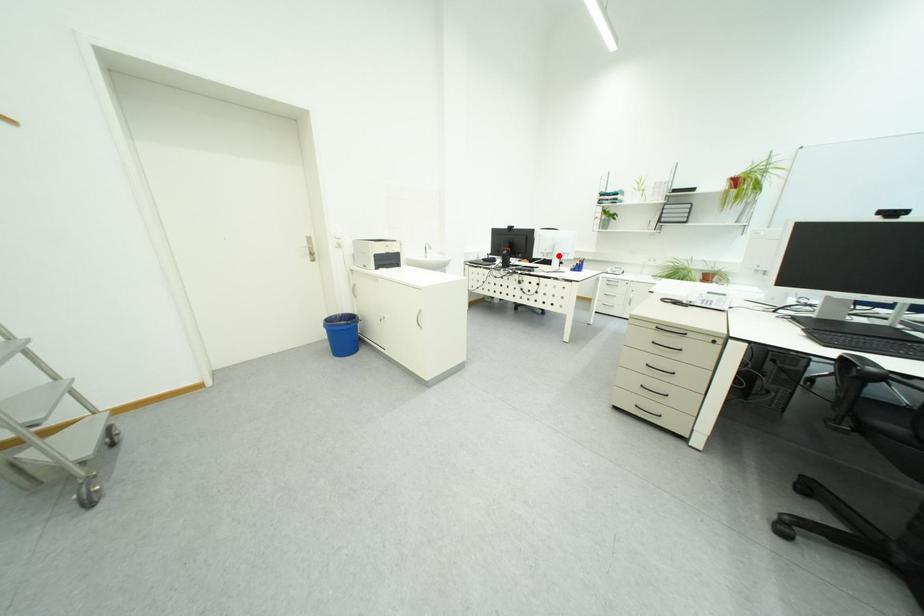
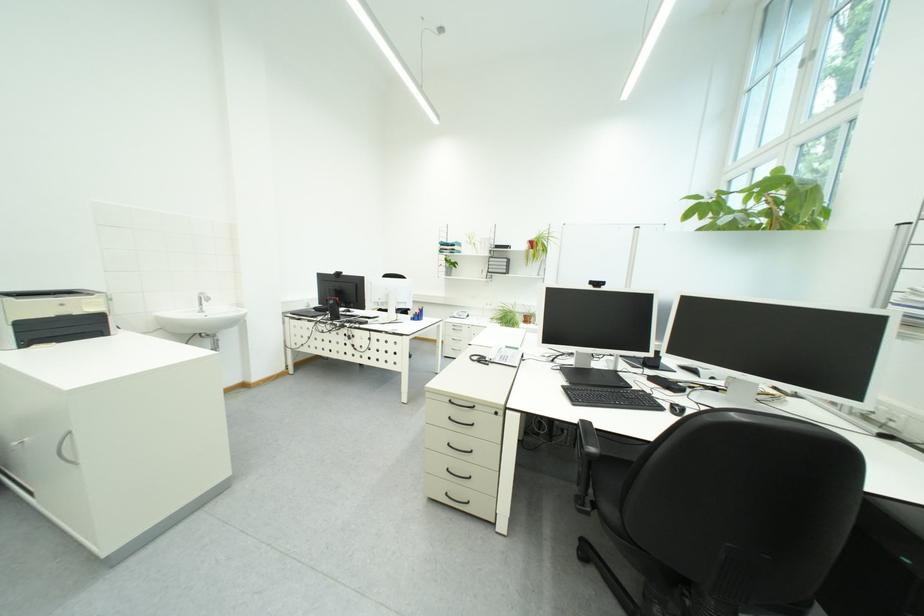
The point at the highlighted location is marked in the first image. Where is the corresponding point in the second image?

(394, 305)